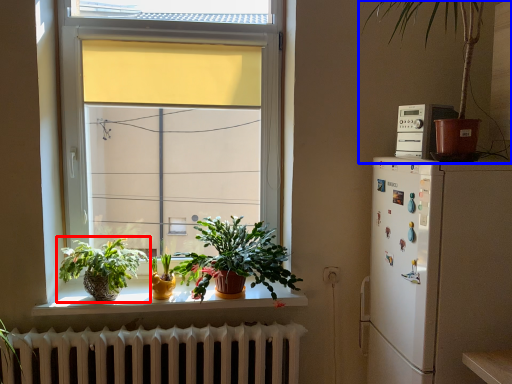
Question: Which object is further to the camera taking this photo, houseplant (highlighted by a red box) or houseplant (highlighted by a blue box)?

Choices:
 (A) houseplant
 (B) houseplant

Answer: (A)